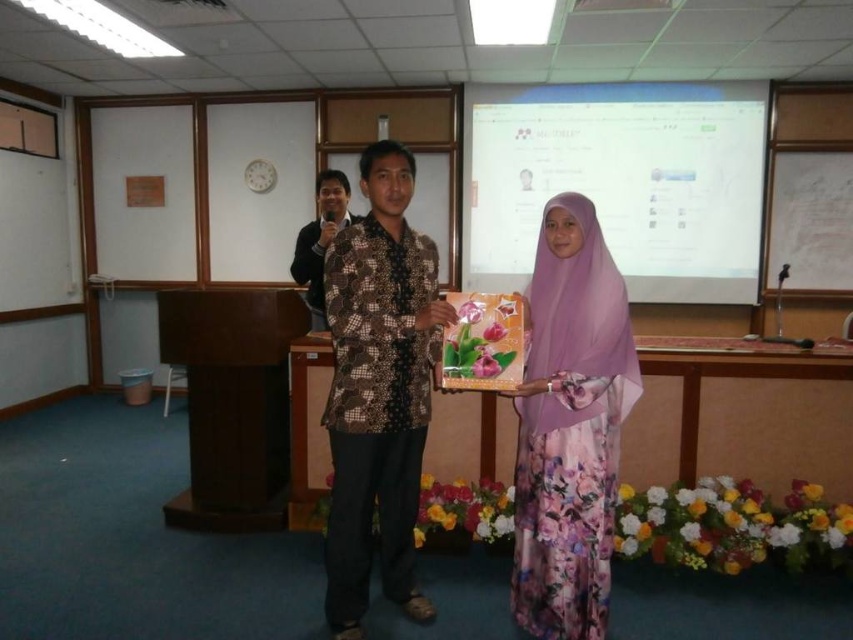
You are standing in the conference room and notice the brown batik shirt at center. Can you estimate its position using the coordinate system where the bottom left corner is the origin?

The brown batik shirt at center is located at point coordinates approximately 0.609 on the x axis and 0.444 on the y axis.

You are standing in the conference room and want to hand a gift box to the person wearing the brown batik shirt at center. Based on their position, where should you approach from to ensure you are facing them directly?

The brown batik shirt at center is positioned at coordinates point (x=378, y=388). To face them directly, you should approach from the front, which would be the direction opposite to their back. Since their exact orientation isn